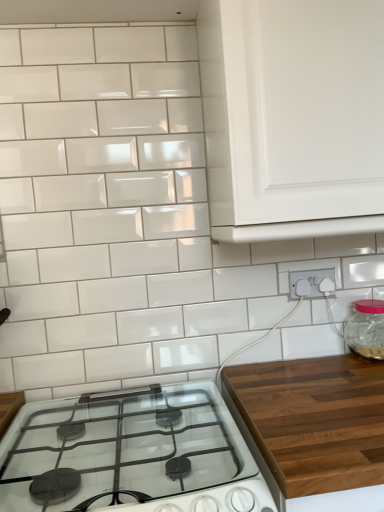
Question: From a real-world perspective, is white plastic electrical outlet at lower right over transparent glass jar at right?

Choices:
 (A) no
 (B) yes

Answer: (B)

Question: Could transparent glass jar at right be considered to be inside white plastic electrical outlet at lower right?

Choices:
 (A) yes
 (B) no

Answer: (B)

Question: From a real-world perspective, is white plastic electrical outlet at lower right located beneath transparent glass jar at right?

Choices:
 (A) no
 (B) yes

Answer: (A)

Question: Considering the relative positions of white plastic electrical outlet at lower right and transparent glass jar at right in the image provided, is white plastic electrical outlet at lower right in front of transparent glass jar at right?

Choices:
 (A) no
 (B) yes

Answer: (A)

Question: Is white plastic electrical outlet at lower right thinner than transparent glass jar at right?

Choices:
 (A) yes
 (B) no

Answer: (A)

Question: From a real-world perspective, is transparent glass jar at right physically located above or below white glossy gas stove at lower center?

Choices:
 (A) below
 (B) above

Answer: (B)

Question: Is point (372, 302) closer or farther from the camera than point (100, 403)?

Choices:
 (A) closer
 (B) farther

Answer: (B)

Question: Would you say transparent glass jar at right is to the left or to the right of white glossy gas stove at lower center in the picture?

Choices:
 (A) right
 (B) left

Answer: (A)

Question: Considering the positions of transparent glass jar at right and white glossy gas stove at lower center in the image, is transparent glass jar at right bigger or smaller than white glossy gas stove at lower center?

Choices:
 (A) big
 (B) small

Answer: (B)

Question: From the image's perspective, is white glossy cabinet at upper right positioned above or below white glossy gas stove at lower center?

Choices:
 (A) above
 (B) below

Answer: (A)

Question: Looking at their shapes, would you say white glossy cabinet at upper right is wider or thinner than white glossy gas stove at lower center?

Choices:
 (A) thin
 (B) wide

Answer: (A)

Question: From a real-world perspective, is white glossy cabinet at upper right physically located above or below white glossy gas stove at lower center?

Choices:
 (A) below
 (B) above

Answer: (B)

Question: Is point (243, 96) positioned closer to the camera than point (180, 426)?

Choices:
 (A) closer
 (B) farther

Answer: (A)

Question: Which is correct: white plastic electrical outlet at lower right is inside transparent glass jar at right, or outside of it?

Choices:
 (A) inside
 (B) outside

Answer: (B)

Question: Is white plastic electrical outlet at lower right to the left or to the right of transparent glass jar at right in the image?

Choices:
 (A) right
 (B) left

Answer: (B)